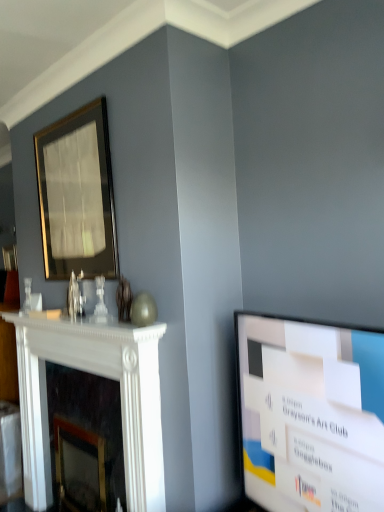
Question: Considering the relative sizes of white marble fireplace at left and white glossy screen at right in the image provided, is white marble fireplace at left thinner than white glossy screen at right?

Choices:
 (A) no
 (B) yes

Answer: (B)

Question: Does white marble fireplace at left come in front of white glossy screen at right?

Choices:
 (A) yes
 (B) no

Answer: (B)

Question: Can you confirm if white marble fireplace at left is bigger than white glossy screen at right?

Choices:
 (A) yes
 (B) no

Answer: (A)

Question: From a real-world perspective, is white marble fireplace at left over white glossy screen at right?

Choices:
 (A) no
 (B) yes

Answer: (A)

Question: Is white marble fireplace at left positioned with its back to white glossy screen at right?

Choices:
 (A) yes
 (B) no

Answer: (B)

Question: From a real-world perspective, is white glossy screen at right above or below gold-framed mirror at upper left?

Choices:
 (A) below
 (B) above

Answer: (A)

Question: In terms of width, does white glossy screen at right look wider or thinner when compared to gold-framed mirror at upper left?

Choices:
 (A) thin
 (B) wide

Answer: (B)

Question: Does point (299, 373) appear closer or farther from the camera than point (104, 181)?

Choices:
 (A) closer
 (B) farther

Answer: (A)

Question: In terms of height, does white glossy screen at right look taller or shorter compared to gold-framed mirror at upper left?

Choices:
 (A) short
 (B) tall

Answer: (A)

Question: Do you think gold-framed mirror at upper left is within white glossy screen at right, or outside of it?

Choices:
 (A) inside
 (B) outside

Answer: (B)

Question: Looking at their shapes, would you say gold-framed mirror at upper left is wider or thinner than white glossy screen at right?

Choices:
 (A) wide
 (B) thin

Answer: (B)

Question: From a real-world perspective, is gold-framed mirror at upper left above or below white glossy screen at right?

Choices:
 (A) below
 (B) above

Answer: (B)

Question: Does point (64, 243) appear closer or farther from the camera than point (340, 508)?

Choices:
 (A) closer
 (B) farther

Answer: (B)

Question: From the image's perspective, relative to gold-framed mirror at upper left, is white marble fireplace at left above or below?

Choices:
 (A) below
 (B) above

Answer: (A)

Question: From a real-world perspective, is white marble fireplace at left positioned above or below gold-framed mirror at upper left?

Choices:
 (A) below
 (B) above

Answer: (A)